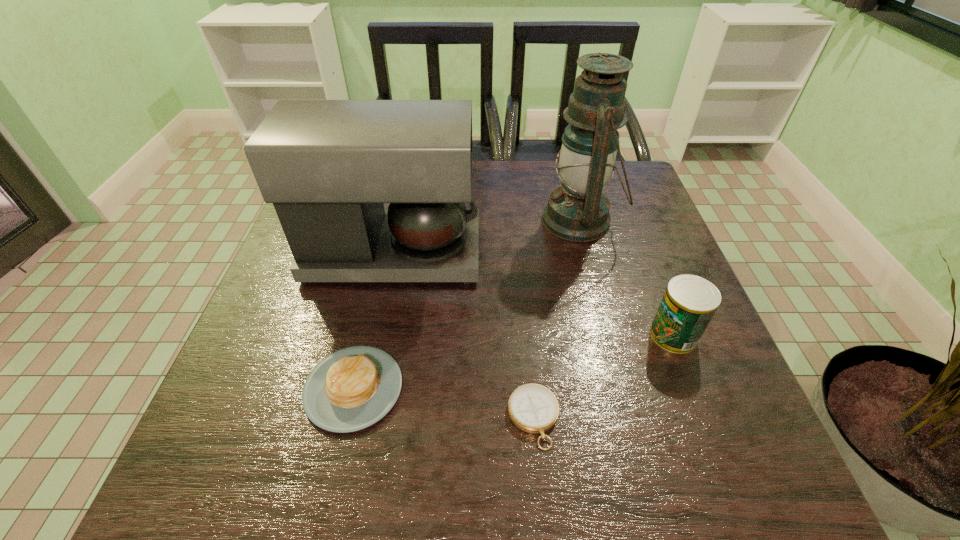
Where is `vacant space located 0.280m on the right of the shortest object`? The width and height of the screenshot is (960, 540). vacant space located 0.280m on the right of the shortest object is located at coordinates (721, 418).

Where is `object located in the far edge section of the desktop`? object located in the far edge section of the desktop is located at coordinates (578, 211).

The image size is (960, 540). What are the coordinates of `object at the near edge` in the screenshot? It's located at (533, 408).

Image resolution: width=960 pixels, height=540 pixels. Identify the location of coffee maker at the left edge. (327, 166).

Identify the location of pancake that is at the left edge. The image size is (960, 540). (351, 389).

Find the location of a particular element. oil lamp that is at the right edge is located at coordinates (578, 211).

The image size is (960, 540). What are the coordinates of `can at the right edge` in the screenshot? It's located at (689, 302).

Where is `object present at the far right corner`? object present at the far right corner is located at coordinates (578, 211).

Identify the location of free space at the near edge of the desktop. Image resolution: width=960 pixels, height=540 pixels. (439, 472).

In the image, there is a desktop. What are the coordinates of `vacant area at the left edge` in the screenshot? It's located at (256, 384).